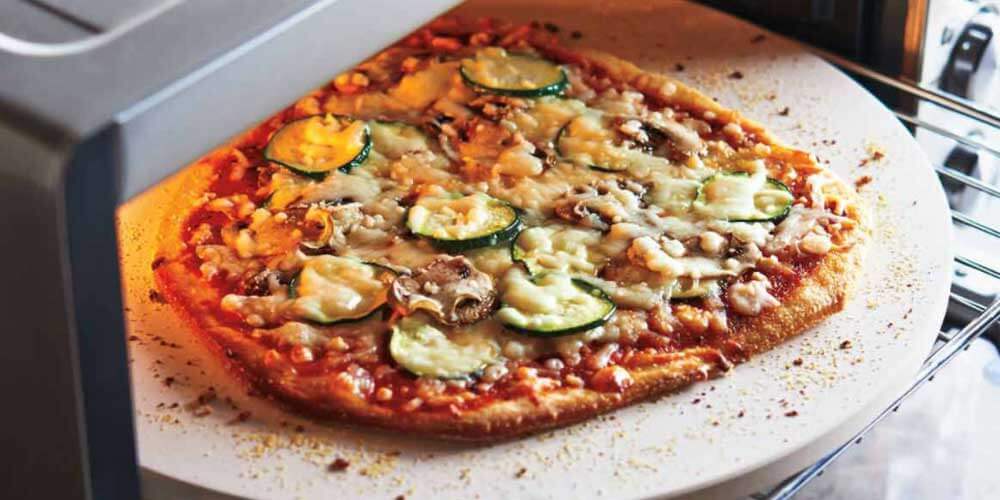
At what (x,y) coordinates should I click in order to perform the action: click on reflection of heat source in oven. Please return your answer as a coordinate pair (x, y). The image size is (1000, 500). Looking at the image, I should click on (162, 213).